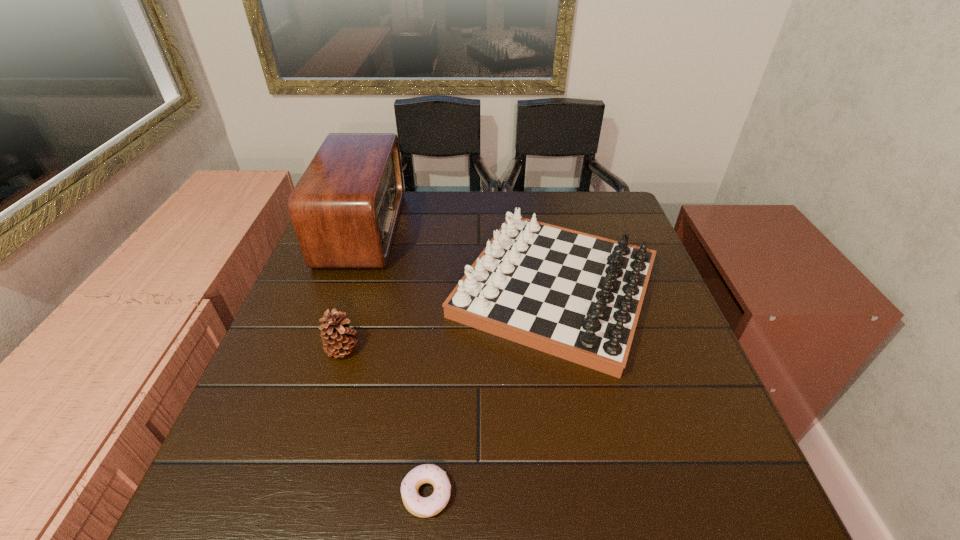
Identify the location of vacant area that lies between the radio receiver and the doughnut. The image size is (960, 540). tap(395, 361).

The image size is (960, 540). Identify the location of blank region between the pinecone and the shortest object. (385, 422).

Locate which object ranks third in proximity to the gameboard. Please provide its 2D coordinates. Your answer should be formatted as a tuple, i.e. [(x, y)], where the tuple contains the x and y coordinates of a point satisfying the conditions above.

[(423, 507)]

At what (x,y) coordinates should I click in order to perform the action: click on object identified as the closest to the gameboard. Please return your answer as a coordinate pair (x, y). This screenshot has width=960, height=540. Looking at the image, I should click on (345, 208).

This screenshot has height=540, width=960. I want to click on vacant area that satisfies the following two spatial constraints: 1. on the front panel of the pinecone; 2. on the right side of the tallest object, so click(x=321, y=349).

The width and height of the screenshot is (960, 540). In order to click on free region that satisfies the following two spatial constraints: 1. on the back side of the gameboard; 2. on the right side of the pinecone in this screenshot , I will do [361, 289].

The width and height of the screenshot is (960, 540). Identify the location of free space that satisfies the following two spatial constraints: 1. on the front panel of the tallest object; 2. on the left side of the nearest object. (270, 494).

Locate an element on the screen. This screenshot has height=540, width=960. vacant position in the image that satisfies the following two spatial constraints: 1. on the back side of the gameboard; 2. on the front panel of the radio receiver is located at coordinates (543, 228).

At what (x,y) coordinates should I click in order to perform the action: click on free location that satisfies the following two spatial constraints: 1. on the back side of the nearest object; 2. on the front panel of the radio receiver. Please return your answer as a coordinate pair (x, y). This screenshot has width=960, height=540. Looking at the image, I should click on (450, 228).

Locate an element on the screen. The image size is (960, 540). vacant space that satisfies the following two spatial constraints: 1. on the front panel of the radio receiver; 2. on the back side of the shortest object is located at coordinates (270, 494).